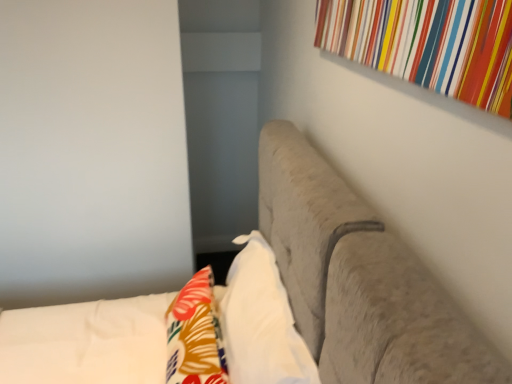
Question: From a real-world perspective, is white soft pillow at center positioned under floral fabric throw pillow at lower left based on gravity?

Choices:
 (A) no
 (B) yes

Answer: (A)

Question: Can you confirm if white soft pillow at center is bigger than floral fabric throw pillow at lower left?

Choices:
 (A) yes
 (B) no

Answer: (A)

Question: Is white soft pillow at center facing towards floral fabric throw pillow at lower left?

Choices:
 (A) yes
 (B) no

Answer: (A)

Question: Is white soft pillow at center turned away from floral fabric throw pillow at lower left?

Choices:
 (A) no
 (B) yes

Answer: (B)

Question: Is white soft pillow at center at the left side of floral fabric throw pillow at lower left?

Choices:
 (A) yes
 (B) no

Answer: (B)

Question: Considering the positions of white soft pillow at center and floral fabric throw pillow at lower left in the image, is white soft pillow at center bigger or smaller than floral fabric throw pillow at lower left?

Choices:
 (A) big
 (B) small

Answer: (A)

Question: Is white soft pillow at center inside the boundaries of floral fabric throw pillow at lower left, or outside?

Choices:
 (A) inside
 (B) outside

Answer: (B)

Question: In terms of height, does white soft pillow at center look taller or shorter compared to floral fabric throw pillow at lower left?

Choices:
 (A) tall
 (B) short

Answer: (A)

Question: From the image's perspective, relative to floral fabric throw pillow at lower left, is white soft pillow at center above or below?

Choices:
 (A) above
 (B) below

Answer: (A)

Question: From the image's perspective, is suede-like beige headboard at upper right above or below white soft pillow at center?

Choices:
 (A) above
 (B) below

Answer: (B)

Question: From a real-world perspective, is suede-like beige headboard at upper right above or below white soft pillow at center?

Choices:
 (A) below
 (B) above

Answer: (A)

Question: Is suede-like beige headboard at upper right spatially inside white soft pillow at center, or outside of it?

Choices:
 (A) outside
 (B) inside

Answer: (A)

Question: Visually, is suede-like beige headboard at upper right positioned to the left or to the right of white soft pillow at center?

Choices:
 (A) left
 (B) right

Answer: (A)

Question: Which is correct: floral fabric throw pillow at lower left is inside white soft pillow at center, or outside of it?

Choices:
 (A) inside
 (B) outside

Answer: (B)

Question: Considering the positions of floral fabric throw pillow at lower left and white soft pillow at center in the image, is floral fabric throw pillow at lower left bigger or smaller than white soft pillow at center?

Choices:
 (A) small
 (B) big

Answer: (A)